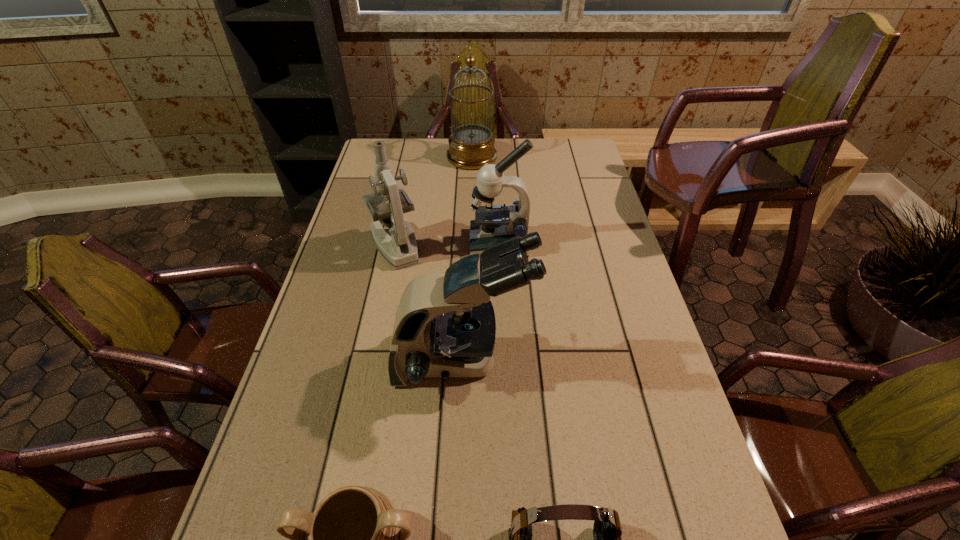
Locate an element on the screen. The width and height of the screenshot is (960, 540). birdcage is located at coordinates (471, 146).

At what (x,y) coordinates should I click in order to perform the action: click on the fourth farthest object. Please return your answer as a coordinate pair (x, y). The image size is (960, 540). Looking at the image, I should click on (445, 326).

Locate an element on the screen. vacant space located 0.110m with an open door on the birdcage is located at coordinates (524, 157).

You are a GUI agent. You are given a task and a screenshot of the screen. Output one action in this format:
    pyautogui.click(x=<x>, y=<y>)
    Task: Click on the free space located through the eyepieces of the fourth farthest object
    
    Given the screenshot: What is the action you would take?
    pyautogui.click(x=550, y=363)

The image size is (960, 540). Find the location of `object that is positioned at the far edge`. object that is positioned at the far edge is located at coordinates (471, 146).

This screenshot has height=540, width=960. In order to click on object positioned at the left edge in this screenshot , I will do `click(400, 250)`.

The width and height of the screenshot is (960, 540). In the image, there is a desktop. In order to click on free space at the far edge in this screenshot , I will do `click(545, 147)`.

You are a GUI agent. You are given a task and a screenshot of the screen. Output one action in this format:
    pyautogui.click(x=<x>, y=<y>)
    Task: Click on the vacant space at the left edge of the desktop
    
    Given the screenshot: What is the action you would take?
    pyautogui.click(x=355, y=316)

Find the location of a particular element. This screenshot has width=960, height=540. blank area at the right edge is located at coordinates coord(579,265).

At what (x,y) coordinates should I click in order to perform the action: click on vacant space at the far left corner. Please return your answer as a coordinate pair (x, y). Looking at the image, I should click on (389, 141).